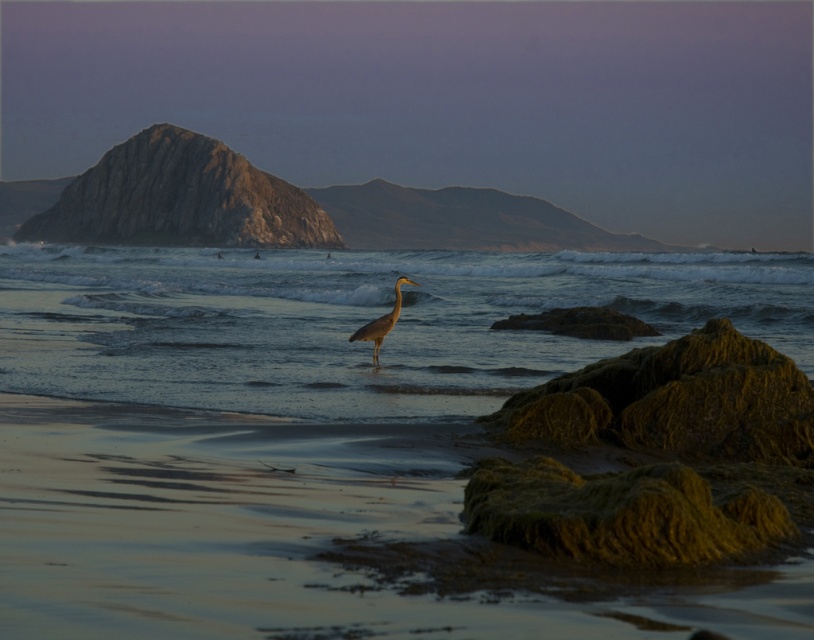
You are standing on the beach and see the sandy water at center and the gray matte heron at center. Which object takes up more space in the image?

The sandy water at center is larger in size than the gray matte heron at center, so it takes up more space in the image.

You are standing on the beach looking at the scene. There are two points marked in the image. Which point, point (x=37, y=384) or point (x=370, y=332), is closer to you?

Point (x=37, y=384) is closer to the viewer than point (x=370, y=332).